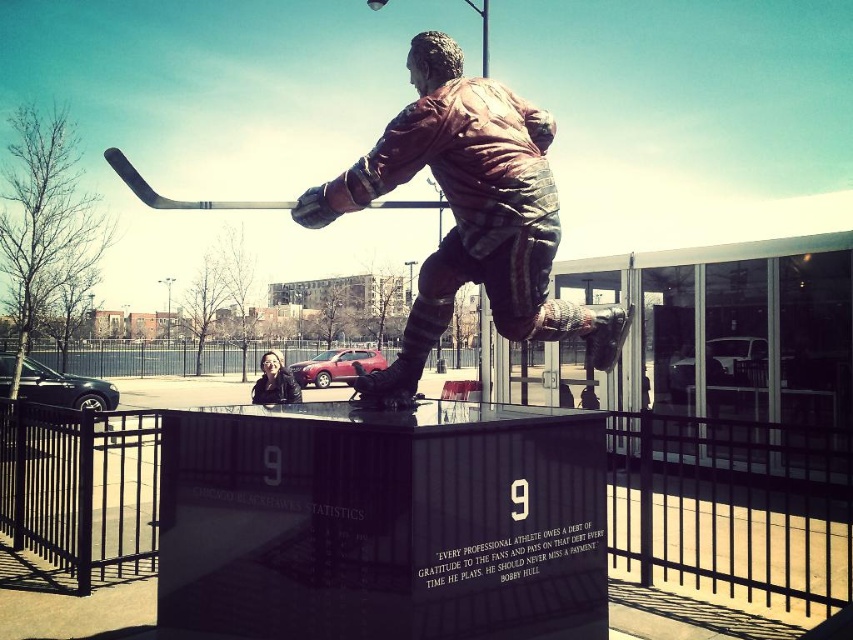
Question: Can you confirm if shiny bronze statue at center is positioned above matte black jacket at center?

Choices:
 (A) yes
 (B) no

Answer: (A)

Question: Is shiny bronze statue at center wider than matte black jacket at center?

Choices:
 (A) yes
 (B) no

Answer: (B)

Question: Which point appears farthest from the camera in this image?

Choices:
 (A) (469, 92)
 (B) (293, 400)

Answer: (B)

Question: Can you confirm if shiny bronze statue at center is positioned to the right of matte black jacket at center?

Choices:
 (A) yes
 (B) no

Answer: (A)

Question: Which point is closer to the camera taking this photo?

Choices:
 (A) (395, 179)
 (B) (293, 378)

Answer: (A)